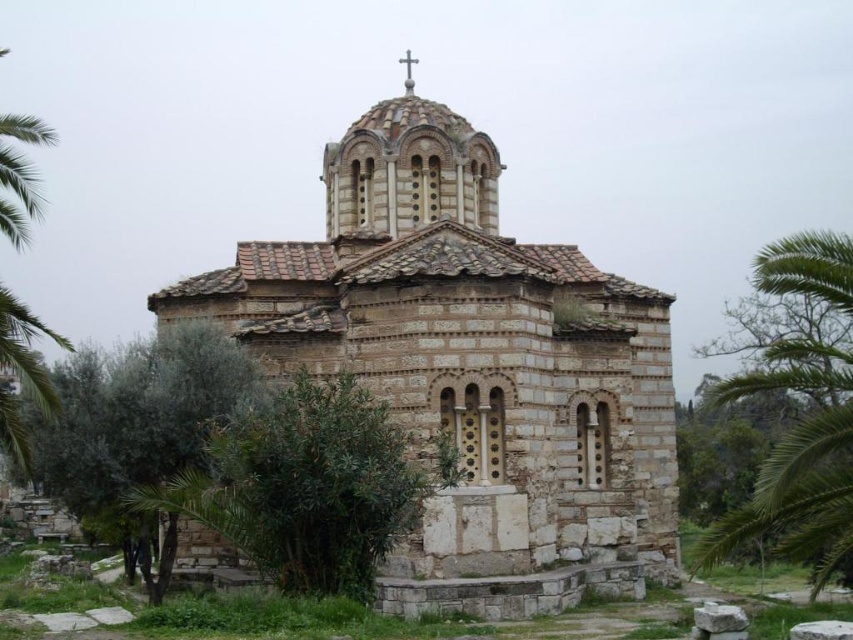
Question: Does white stone church at center have a lesser width compared to green leafy palm tree at left?

Choices:
 (A) no
 (B) yes

Answer: (B)

Question: Is green leafy palm tree at right above white wooden cross at upper center?

Choices:
 (A) no
 (B) yes

Answer: (A)

Question: Based on their relative distances, which object is farther from the white wooden cross at upper center?

Choices:
 (A) green leafy palm tree at left
 (B) green leafy bush at center

Answer: (A)

Question: Can you confirm if green leafy palm tree at left is wider than white wooden cross at upper center?

Choices:
 (A) no
 (B) yes

Answer: (B)

Question: Estimate the real-world distances between objects in this image. Which object is farther from the white wooden cross at upper center?

Choices:
 (A) white stone church at center
 (B) green leafy palm tree at left
 (C) green leafy palm tree at right

Answer: (C)

Question: Which of the following is the farthest from the observer?

Choices:
 (A) (816, 419)
 (B) (440, 452)

Answer: (A)